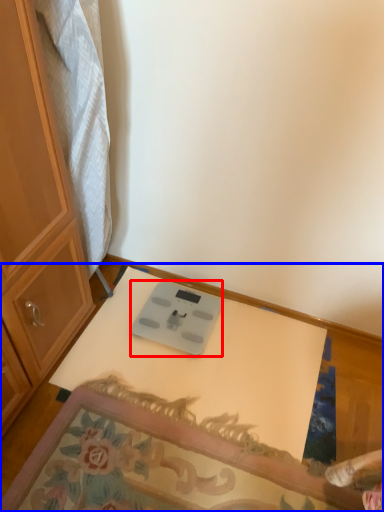
Question: Which of the following is the farthest to the observer, weight scale (highlighted by a red box) or table (highlighted by a blue box)?

Choices:
 (A) weight scale
 (B) table

Answer: (A)